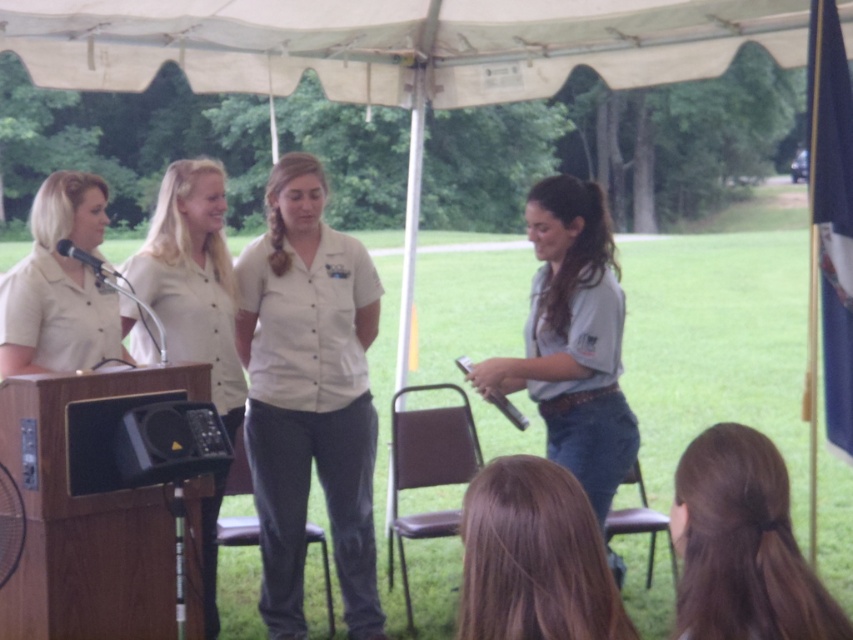
You are standing at the point with coordinates point (30,221) and want to walk towards the point with coordinates point (544,88). Which direction should you face to walk directly towards it?

You should face north because point (544,88) is in front of point (30,221).